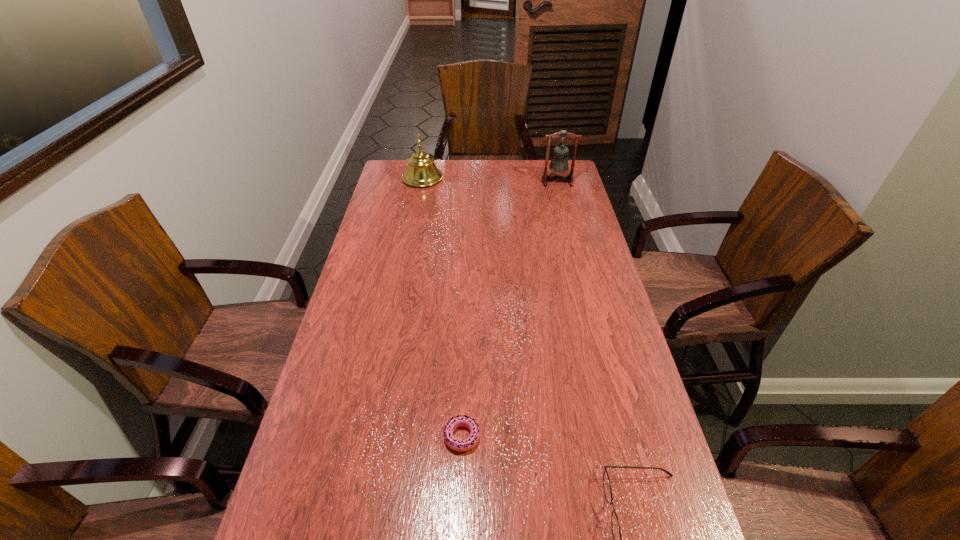
At what (x,y) coordinates should I click in order to perform the action: click on the right bell. Please return your answer as a coordinate pair (x, y). Image resolution: width=960 pixels, height=540 pixels. Looking at the image, I should click on (559, 163).

Find the location of a particular element. Image resolution: width=960 pixels, height=540 pixels. the leftmost object is located at coordinates (421, 171).

Where is `the third farthest object`? the third farthest object is located at coordinates (459, 421).

What are the coordinates of `the second object from left to right` in the screenshot? It's located at (459, 421).

This screenshot has width=960, height=540. I want to click on free location located 0.190m on the left of the right bell, so click(x=497, y=181).

Find the location of a particular element. The height and width of the screenshot is (540, 960). free spot located on the right of the leftmost object is located at coordinates (490, 178).

At what (x,y) coordinates should I click in order to perform the action: click on free region located on the right of the third farthest object. Please return your answer as a coordinate pair (x, y). Looking at the image, I should click on (551, 436).

You are a GUI agent. You are given a task and a screenshot of the screen. Output one action in this format:
    pyautogui.click(x=<x>, y=<y>)
    Task: Click on the object present at the left edge
    
    Given the screenshot: What is the action you would take?
    pyautogui.click(x=421, y=171)

Locate an element on the screen. This screenshot has width=960, height=540. object present at the right edge is located at coordinates (559, 163).

You are a GUI agent. You are given a task and a screenshot of the screen. Output one action in this format:
    pyautogui.click(x=<x>, y=<y>)
    Task: Click on the object located in the far left corner section of the desktop
    This screenshot has height=540, width=960.
    Given the screenshot: What is the action you would take?
    pyautogui.click(x=421, y=171)